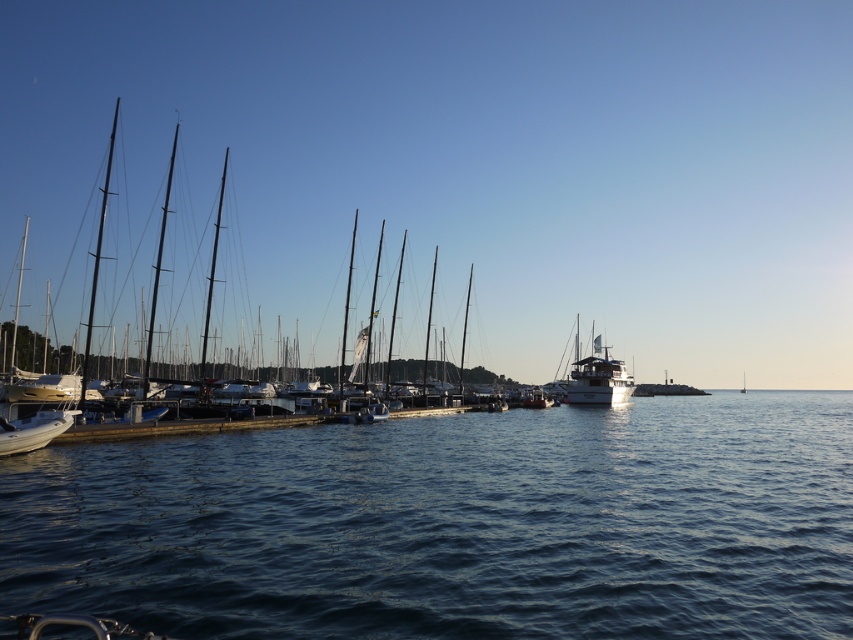
Question: Observing the image, what is the correct spatial positioning of white glossy boat at lower left in reference to white glossy sailboat at center?

Choices:
 (A) above
 (B) below

Answer: (A)

Question: Is white glossy boat at lower left below white glossy sailboat at center?

Choices:
 (A) no
 (B) yes

Answer: (A)

Question: Which point is closer to the camera taking this photo?

Choices:
 (A) click(575, 362)
 (B) click(39, 422)

Answer: (B)

Question: Does blue water at center have a larger size compared to white glossy boat at lower left?

Choices:
 (A) yes
 (B) no

Answer: (A)

Question: Which object is the farthest from the white glossy boat at lower left?

Choices:
 (A) white glossy sailboat at center
 (B) blue water at center
 (C) white glossy yacht at center

Answer: (A)

Question: Among these points, which one is farthest from the camera?

Choices:
 (A) (42, 442)
 (B) (741, 376)

Answer: (B)